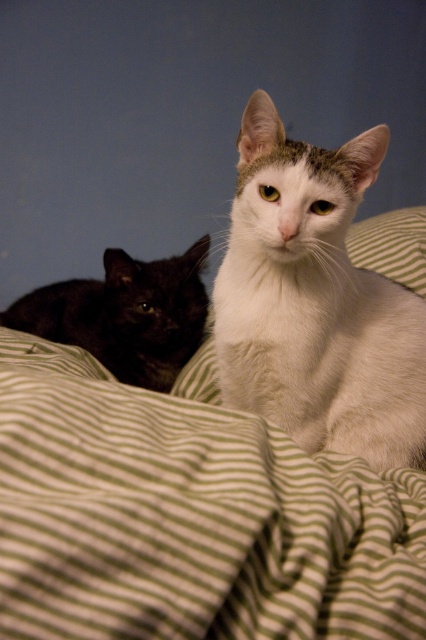
Can you confirm if white fluffy cat at center is positioned below black glossy cat at left?

Incorrect, white fluffy cat at center is not positioned below black glossy cat at left.

Who is more distant from viewer, (319, 442) or (103, 330)?

Positioned behind is point (103, 330).

Find the location of a particular element. white fluffy cat at center is located at coordinates (316, 301).

How far apart are green striped blanket at center and green striped pillow at center?

green striped blanket at center and green striped pillow at center are 30.16 inches apart.

Between green striped blanket at center and green striped pillow at center, which one has less height?

green striped pillow at center

Find the location of a particular element. green striped blanket at center is located at coordinates (187, 518).

Is white fluffy cat at center above green striped pillow at center?

Incorrect, white fluffy cat at center is not positioned above green striped pillow at center.

Between point (397, 349) and point (399, 237), which one is positioned in front?

Positioned in front is point (397, 349).

Measure the distance between point (351, 408) and camera.

37.34 inches

This screenshot has height=640, width=426. I want to click on white fluffy cat at center, so (x=316, y=301).